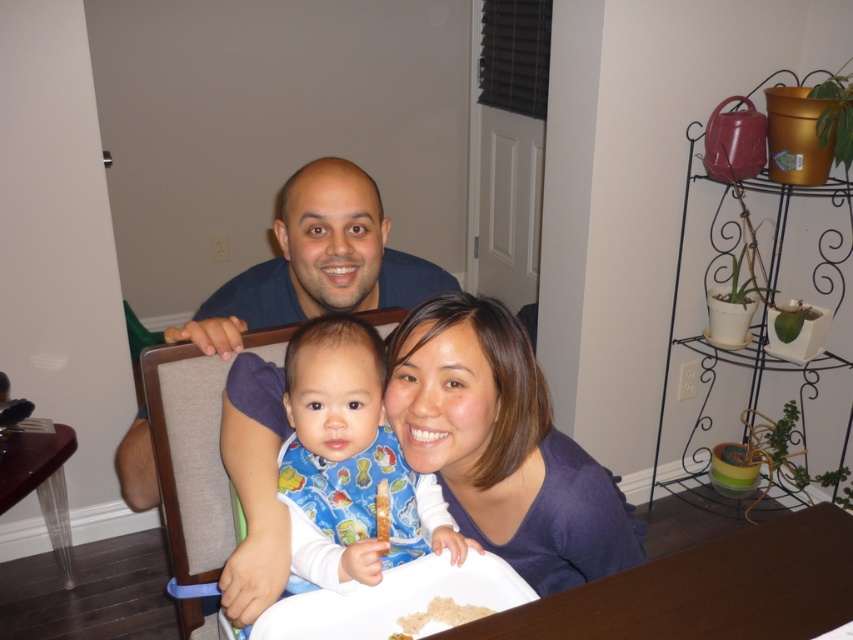
Measure the distance between fabric high chair at center and camera.

fabric high chair at center is 36.40 inches from camera.

Does point (166, 461) lie in front of point (38, 442)?

Yes, it is.

Which is behind, point (161, 460) or point (51, 490)?

The point (51, 490) is more distant.

Locate an element on the screen. The width and height of the screenshot is (853, 640). fabric high chair at center is located at coordinates (195, 461).

Between fabric high chair at center and brown crumbly rice at lower center, which one is positioned lower?

Positioned lower is brown crumbly rice at lower center.

Identify the location of fabric high chair at center. The image size is (853, 640). (195, 461).

Does purple matte shirt at center have a greater width compared to brown wooden table at lower center?

Incorrect, purple matte shirt at center's width does not surpass brown wooden table at lower center's.

Locate an element on the screen. The width and height of the screenshot is (853, 640). purple matte shirt at center is located at coordinates (502, 445).